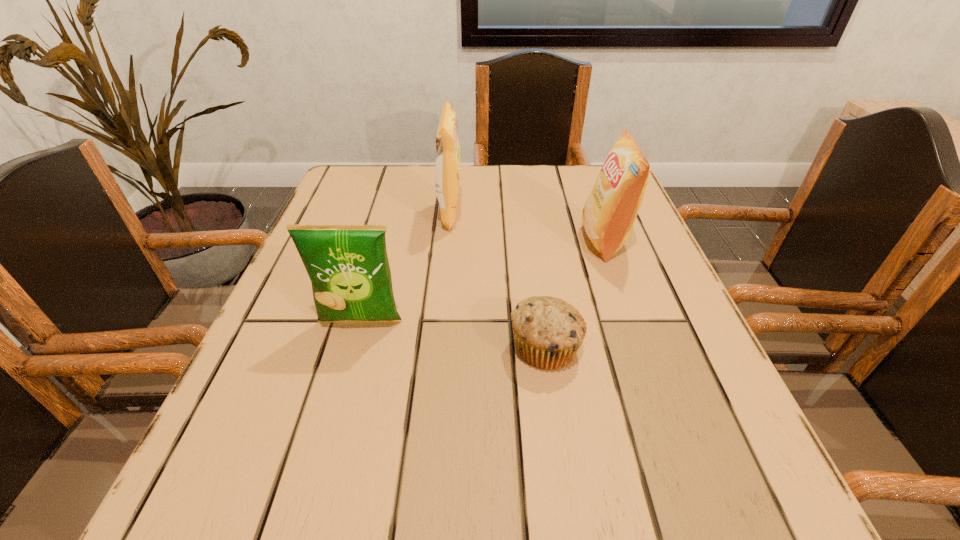
Locate an element on the screen. This screenshot has height=540, width=960. unoccupied area between the nearest crisp (potato chip) and the muffin is located at coordinates (453, 334).

Find the location of a particular element. The height and width of the screenshot is (540, 960). empty location between the third object from right to left and the shortest object is located at coordinates pyautogui.click(x=497, y=280).

At what (x,y) coordinates should I click in order to perform the action: click on object that is the third closest to the second crisp (potato chip) from left to right. Please return your answer as a coordinate pair (x, y). This screenshot has width=960, height=540. Looking at the image, I should click on (548, 332).

Where is `object that is the second closest to the third object from left to right`? object that is the second closest to the third object from left to right is located at coordinates (348, 266).

Locate which crisp (potato chip) ranks second in proximity to the rightmost crisp (potato chip). Please provide its 2D coordinates. Your answer should be formatted as a tuple, i.e. [(x, y)], where the tuple contains the x and y coordinates of a point satisfying the conditions above.

[(348, 266)]

Identify which crisp (potato chip) is the second nearest to the leftmost crisp (potato chip). Please provide its 2D coordinates. Your answer should be formatted as a tuple, i.e. [(x, y)], where the tuple contains the x and y coordinates of a point satisfying the conditions above.

[(610, 211)]

The width and height of the screenshot is (960, 540). In order to click on free space that satisfies the following two spatial constraints: 1. on the front of the second crisp (potato chip) from right to left with the logo; 2. on the front-facing side of the nearest crisp (potato chip) in this screenshot , I will do `click(440, 321)`.

What are the coordinates of `blank area in the image that satisfies the following two spatial constraints: 1. on the front-facing side of the rightmost crisp (potato chip); 2. on the front-facing side of the leftmost object` in the screenshot? It's located at (634, 321).

Locate an element on the screen. The width and height of the screenshot is (960, 540). blank area in the image that satisfies the following two spatial constraints: 1. on the front of the second object from left to right with the logo; 2. on the left side of the second object from right to left is located at coordinates (438, 347).

What are the coordinates of `vacant position in the image that satisfies the following two spatial constraints: 1. on the front-facing side of the rightmost crisp (potato chip); 2. on the front-facing side of the leftmost crisp (potato chip)` in the screenshot? It's located at (634, 321).